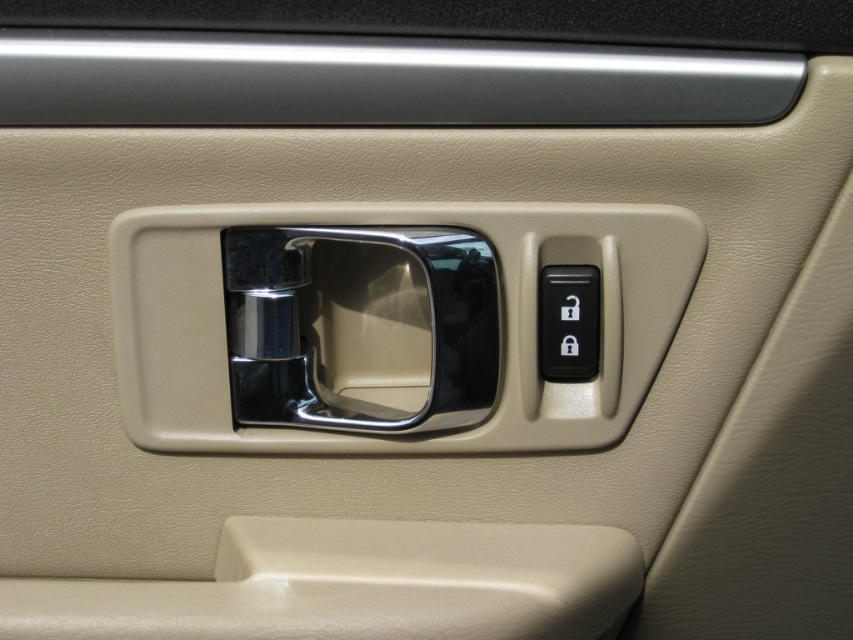
Which is behind, point (489, 352) or point (556, 346)?

The point (556, 346) is more distant.

Who is more forward, (x=250, y=348) or (x=555, y=330)?

Positioned in front is point (x=250, y=348).

Where is `chrome/metallic door handle at center`? This screenshot has width=853, height=640. chrome/metallic door handle at center is located at coordinates (315, 346).